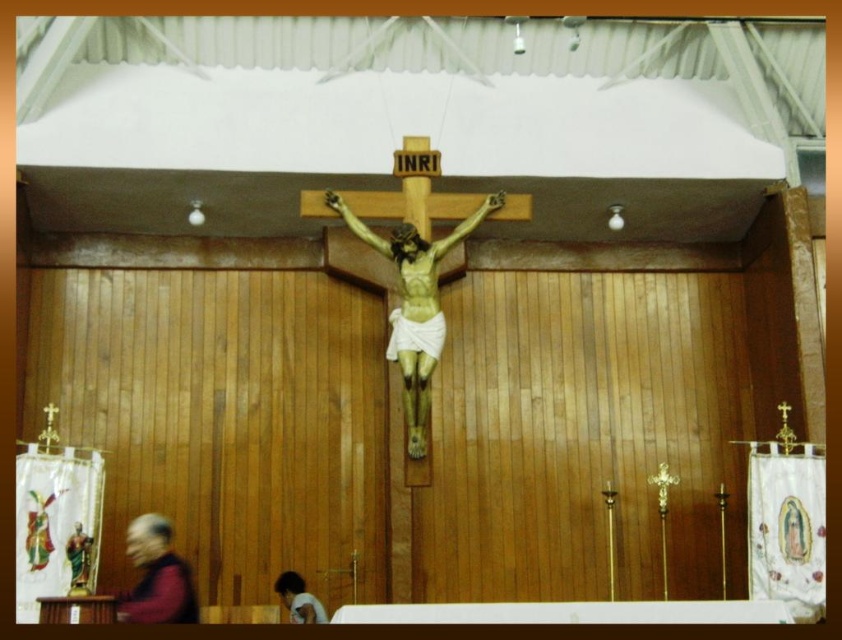
Does wooden crucifix at center appear over golden statue at lower left?

Correct, wooden crucifix at center is located above golden statue at lower left.

Can you confirm if wooden crucifix at center is shorter than golden statue at lower left?

Incorrect, wooden crucifix at center's height does not fall short of golden statue at lower left's.

This screenshot has width=842, height=640. In order to click on wooden crucifix at center in this screenshot , I will do `click(414, 305)`.

Where is `wooden crucifix at center`? wooden crucifix at center is located at coordinates (414, 305).

This screenshot has height=640, width=842. Describe the element at coordinates (156, 577) in the screenshot. I see `smooth gray hair at lower left` at that location.

Measure the distance between smooth gray hair at lower left and golden statue at lower left.

11.34 feet

Does point (182, 616) come behind point (76, 580)?

No, it is in front of (76, 580).

This screenshot has width=842, height=640. Identify the location of smooth gray hair at lower left. (156, 577).

At what (x,y) coordinates should I click in order to perform the action: click on wooden crucifix at center. Please return your answer as a coordinate pair (x, y). The height and width of the screenshot is (640, 842). Looking at the image, I should click on (414, 305).

Image resolution: width=842 pixels, height=640 pixels. What do you see at coordinates (414, 305) in the screenshot? I see `wooden crucifix at center` at bounding box center [414, 305].

Measure the distance between point [456,227] and camera.

53.72 meters

The image size is (842, 640). What are the coordinates of `wooden crucifix at center` in the screenshot? It's located at (414, 305).